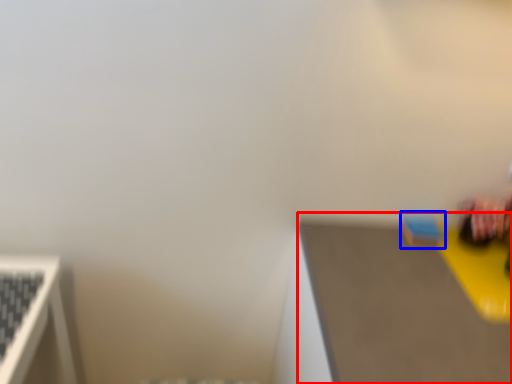
Question: Which point is closer to the camera, table top (highlighted by a red box) or toy (highlighted by a blue box)?

Choices:
 (A) table top
 (B) toy

Answer: (A)